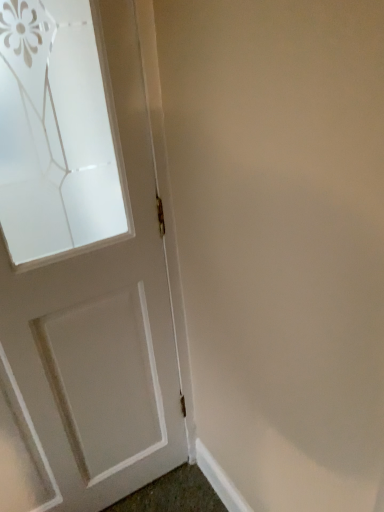
Question: Is white painted wood door at left in front of or behind white smooth baseboard at lower right in the image?

Choices:
 (A) front
 (B) behind

Answer: (A)

Question: From a real-world perspective, is white painted wood door at left positioned above or below white smooth baseboard at lower right?

Choices:
 (A) below
 (B) above

Answer: (B)

Question: Is point (33, 312) closer or farther from the camera than point (200, 441)?

Choices:
 (A) farther
 (B) closer

Answer: (B)

Question: Considering the positions of white smooth baseboard at lower right and white painted wood door at left in the image, is white smooth baseboard at lower right bigger or smaller than white painted wood door at left?

Choices:
 (A) small
 (B) big

Answer: (A)

Question: Is point tap(244, 505) closer or farther from the camera than point tap(112, 219)?

Choices:
 (A) farther
 (B) closer

Answer: (B)

Question: Considering their positions, is white smooth baseboard at lower right located in front of or behind white painted wood door at left?

Choices:
 (A) front
 (B) behind

Answer: (B)

Question: From the image's perspective, is white smooth baseboard at lower right located above or below white painted wood door at left?

Choices:
 (A) below
 (B) above

Answer: (A)